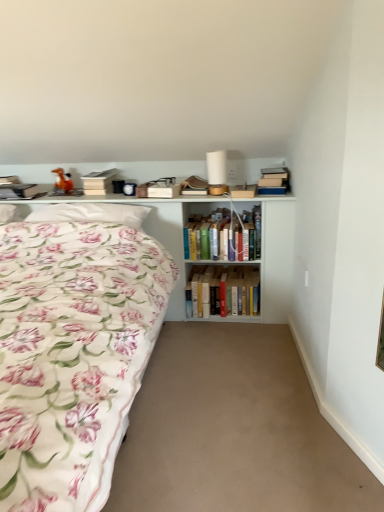
You are a GUI agent. You are given a task and a screenshot of the screen. Output one action in this format:
    pyautogui.click(x=<x>, y=<y>)
    Task: Click on the vacant area that is in front of orange matte toy horse at upper left
    Image resolution: width=384 pixels, height=512 pixels.
    Given the screenshot: What is the action you would take?
    pyautogui.click(x=66, y=193)